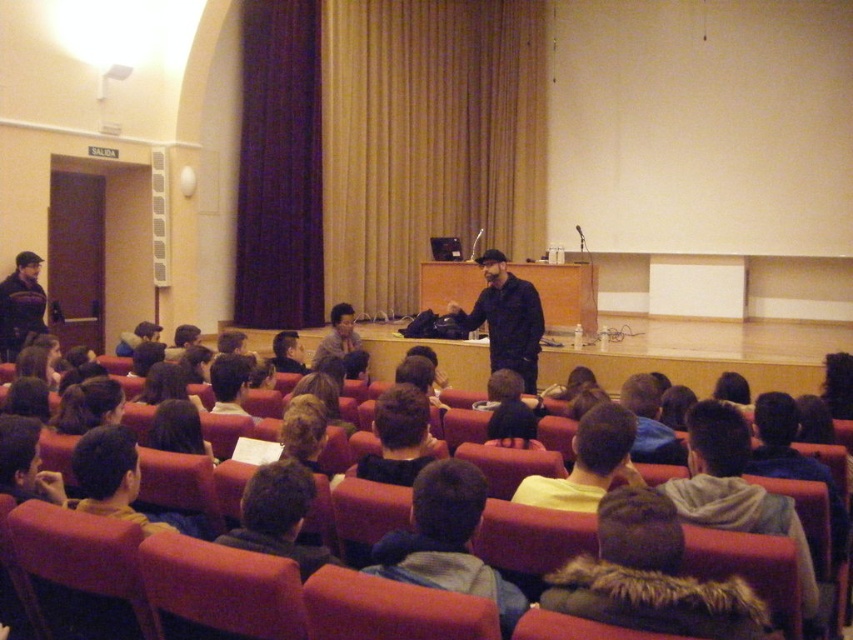
Question: Does dark blue hoodie at center have a greater width compared to matte black jacket at left?

Choices:
 (A) yes
 (B) no

Answer: (A)

Question: Among these objects, which one is nearest to the camera?

Choices:
 (A) black matte jacket at center
 (B) dark brown hair at lower left

Answer: (B)

Question: Does dark brown hair at center appear under matte black jacket at left?

Choices:
 (A) no
 (B) yes

Answer: (B)

Question: Among these objects, which one is nearest to the camera?

Choices:
 (A) matte black jacket at left
 (B) yellow cotton shirt at lower center
 (C) fuzzy gray hat at lower center
 (D) black fabric head at center

Answer: (C)

Question: Which of the following is the closest to the observer?

Choices:
 (A) dark brown hair at lower left
 (B) black fabric head at center
 (C) fuzzy gray hat at lower center

Answer: (C)

Question: In this image, where is yellow cotton shirt at lower center located relative to black matte jacket at center?

Choices:
 (A) below
 (B) above

Answer: (A)